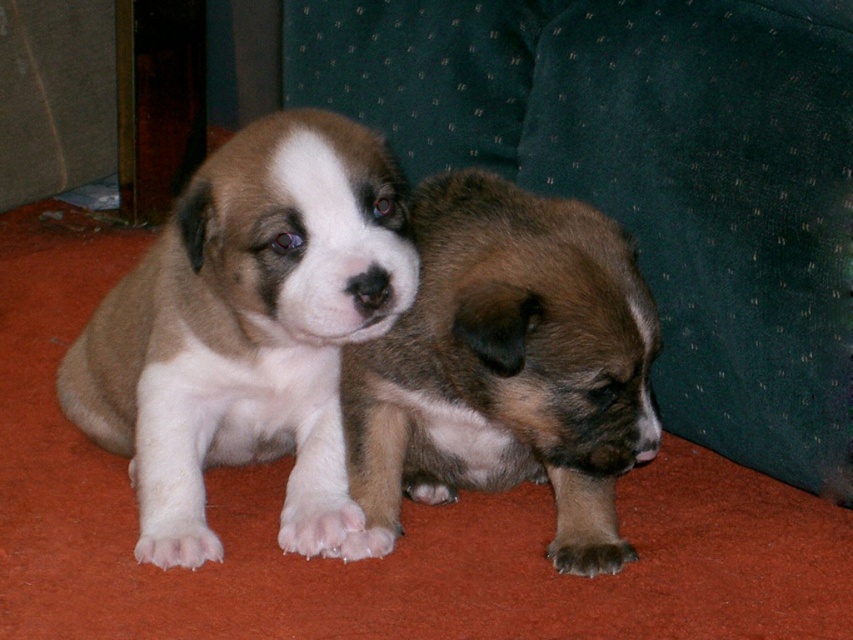
Does soft brown fur puppy at center have a lesser height compared to brown fuzzy puppy at center?

Incorrect, soft brown fur puppy at center's height does not fall short of brown fuzzy puppy at center's.

Is point (218, 308) less distant than point (486, 196)?

No, (218, 308) is behind (486, 196).

Identify the location of soft brown fur puppy at center. The width and height of the screenshot is (853, 640). (247, 330).